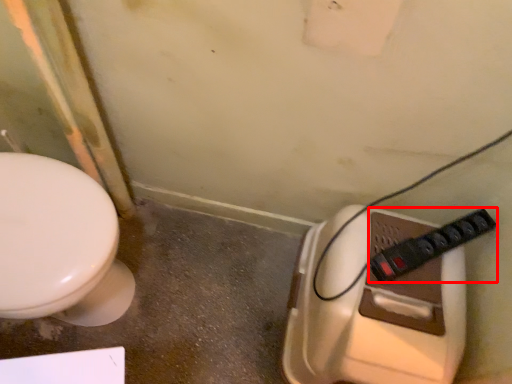
Question: From the image's perspective, where is plug (annotated by the red box) located relative to toilet?

Choices:
 (A) above
 (B) below

Answer: (A)